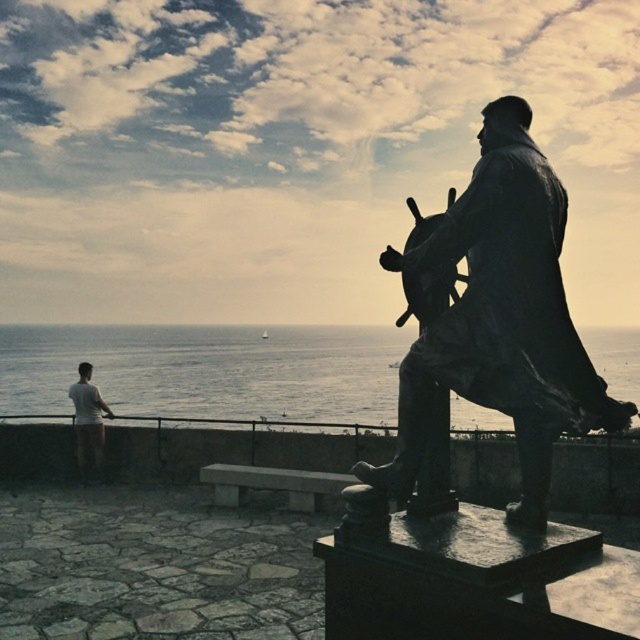
Question: Considering the real-world distances, which object is closest to the shiny metal gun at center?

Choices:
 (A) white cotton shorts at lower left
 (B) bronze ship captain at right

Answer: (B)

Question: Does shiny metal gun at center have a greater width compared to white cotton shorts at lower left?

Choices:
 (A) yes
 (B) no

Answer: (B)

Question: Which object is the farthest from the white cotton shorts at lower left?

Choices:
 (A) silvery water at lower left
 (B) shiny metal gun at center
 (C) bronze ship captain at right

Answer: (C)

Question: Can you confirm if bronze ship captain at right is wider than shiny metal gun at center?

Choices:
 (A) no
 (B) yes

Answer: (B)

Question: Among these points, which one is nearest to the camera?

Choices:
 (A) (620, 392)
 (B) (440, 212)
 (C) (76, 435)
 (D) (508, 204)

Answer: (D)

Question: Can you confirm if bronze ship captain at right is positioned below shiny metal gun at center?

Choices:
 (A) yes
 (B) no

Answer: (A)